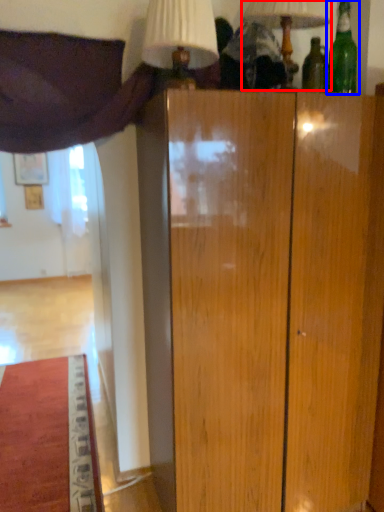
Question: Which object is further to the camera taking this photo, table lamp (highlighted by a red box) or bottle (highlighted by a blue box)?

Choices:
 (A) table lamp
 (B) bottle

Answer: (B)